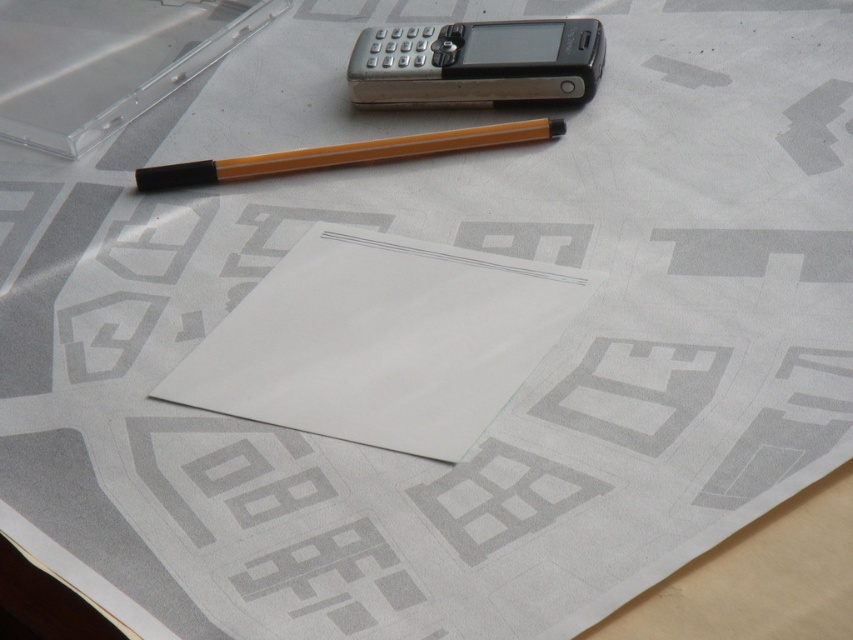
Question: Can you confirm if silver metallic smartphone at center is positioned to the right of yellow striped pencil at center?

Choices:
 (A) yes
 (B) no

Answer: (A)

Question: Does silver metallic smartphone at center lie behind yellow striped pencil at center?

Choices:
 (A) yes
 (B) no

Answer: (A)

Question: Is silver metallic smartphone at center below yellow striped pencil at center?

Choices:
 (A) yes
 (B) no

Answer: (B)

Question: Which object appears farthest from the camera in this image?

Choices:
 (A) silver metallic smartphone at center
 (B) rubber eraser at center
 (C) yellow striped pencil at center
 (D) white paper at center

Answer: (B)

Question: Which of these objects is positioned closest to the rubber eraser at center?

Choices:
 (A) white paper at center
 (B) yellow striped pencil at center

Answer: (B)

Question: Among these objects, which one is nearest to the camera?

Choices:
 (A) rubber eraser at center
 (B) yellow striped pencil at center

Answer: (B)